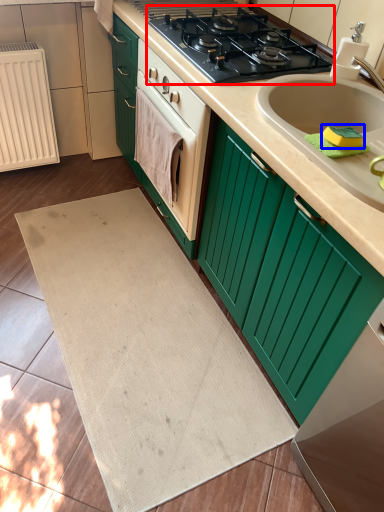
Question: Which object appears closest to the camera in this image, gas stove (highlighted by a red box) or soap (highlighted by a blue box)?

Choices:
 (A) gas stove
 (B) soap

Answer: (B)